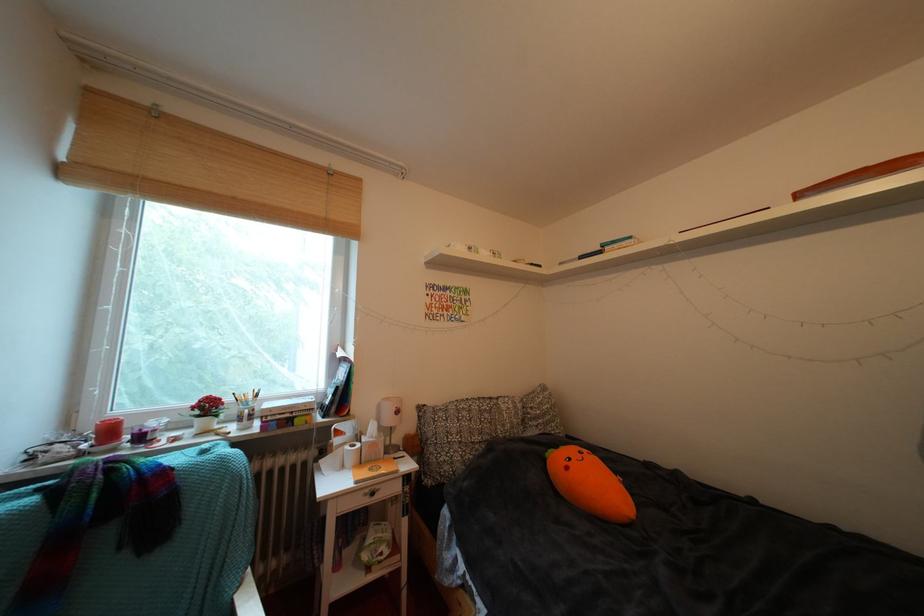
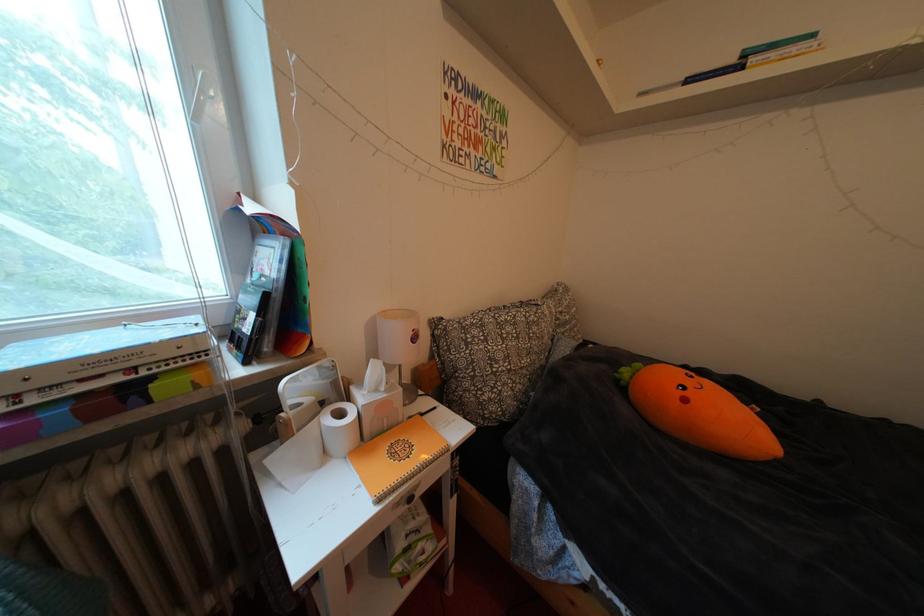
In a continuous first-person perspective shot, in which direction is the camera moving?

The cameraman walked toward left, forward.